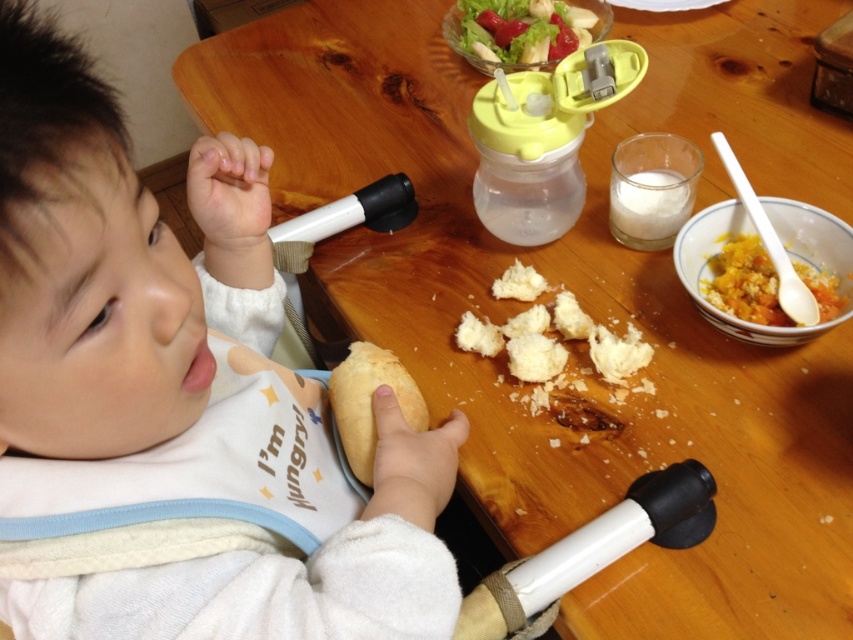
Question: In this image, where is fresh green lettuce at upper center located relative to soft white bread at lower center?

Choices:
 (A) below
 (B) above

Answer: (B)

Question: Is white soft bread at lower right closer to the viewer compared to white fluffy bread crumbs at center?

Choices:
 (A) yes
 (B) no

Answer: (A)

Question: Which point appears closest to the camera in this image?

Choices:
 (A) (819, 323)
 (B) (485, 45)
 (C) (422, 412)

Answer: (C)

Question: Among these points, which one is farthest from the camera?

Choices:
 (A) (737, 268)
 (B) (233, 154)
 (C) (639, 362)
 (D) (503, 17)

Answer: (D)

Question: Is white soft bread at lower right to the right of soft white bread at lower center from the viewer's perspective?

Choices:
 (A) no
 (B) yes

Answer: (A)

Question: Which point is farther from the camera taking this photo?

Choices:
 (A) (386, 371)
 (B) (316, 416)
 (C) (497, 1)

Answer: (C)